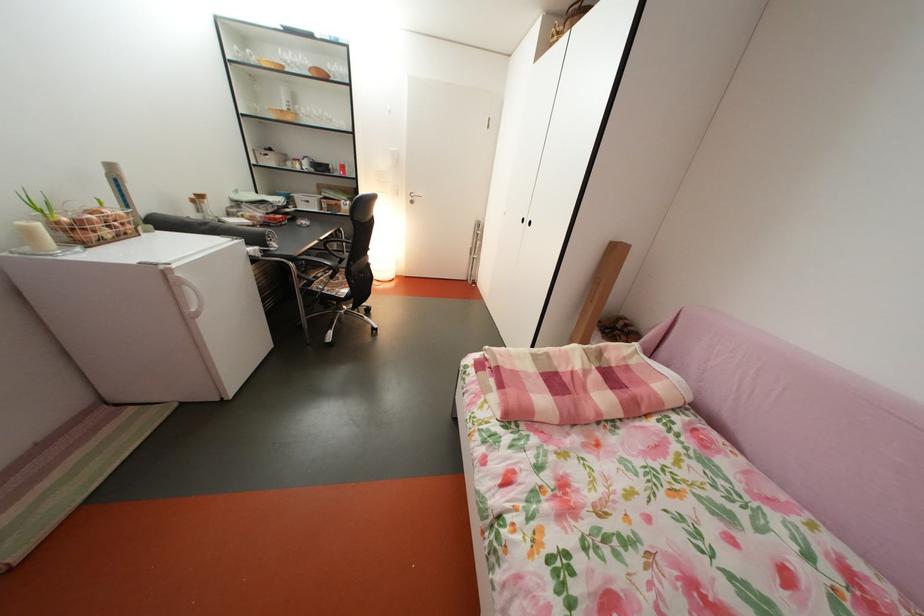
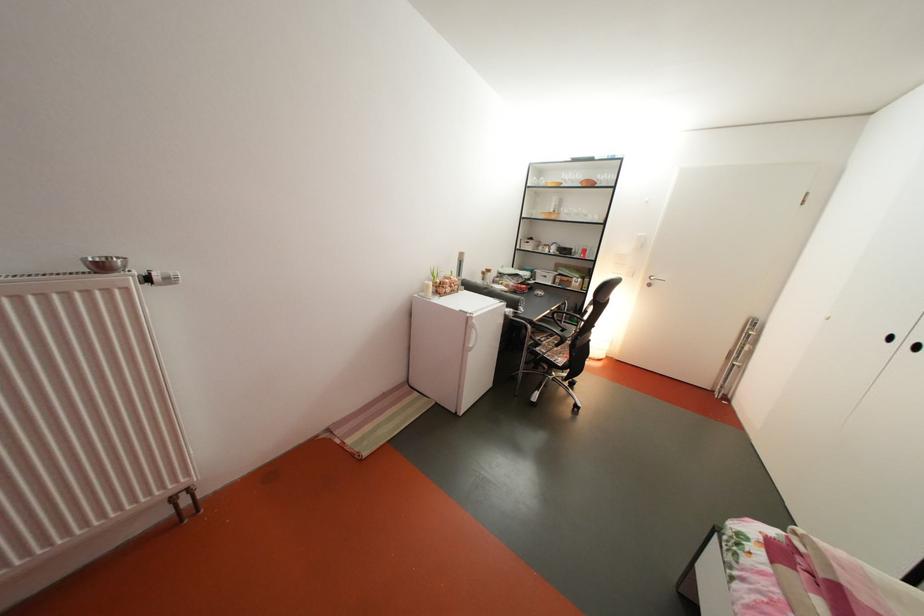
Where in the second image is the point corresponding to [349,174] from the first image?

(591, 257)